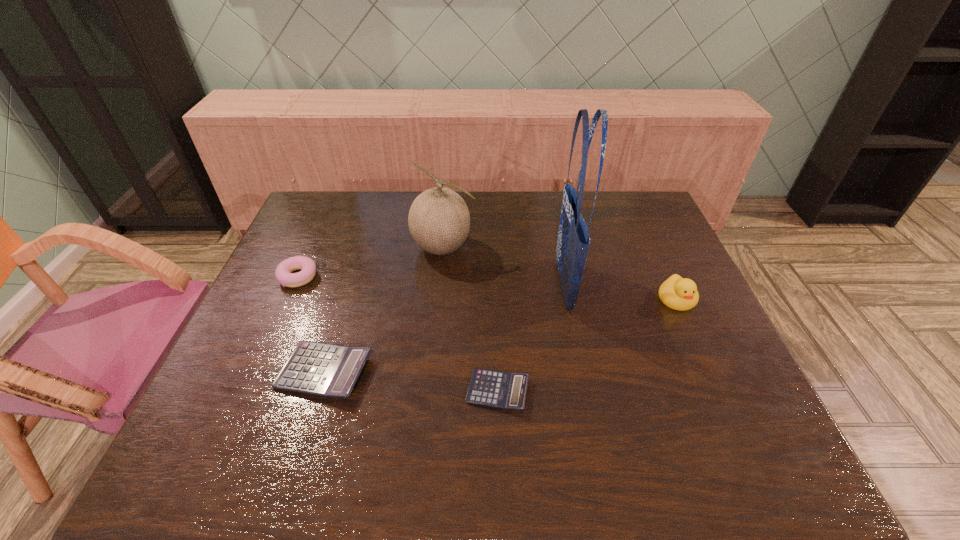
The width and height of the screenshot is (960, 540). What are the coordinates of `vacant space situated on the right of the left calculator` in the screenshot? It's located at (464, 372).

You are a GUI agent. You are given a task and a screenshot of the screen. Output one action in this format:
    pyautogui.click(x=<x>, y=<y>)
    Task: Click on the free space located on the right of the right calculator
    The height and width of the screenshot is (540, 960).
    Given the screenshot: What is the action you would take?
    pyautogui.click(x=626, y=391)

Image resolution: width=960 pixels, height=540 pixels. I want to click on free space located on the front-facing side of the tallest object, so click(463, 285).

This screenshot has width=960, height=540. Identify the location of free point located on the front-facing side of the tallest object. (427, 285).

Find the location of a particular element. The width and height of the screenshot is (960, 540). free point located 0.160m on the front-facing side of the tallest object is located at coordinates pyautogui.click(x=498, y=285).

Where is `free region located on the front of the doughnut`? This screenshot has height=540, width=960. free region located on the front of the doughnut is located at coordinates (274, 335).

Where is `blank space located on the front of the cantaloup`? blank space located on the front of the cantaloup is located at coordinates (436, 328).

Identify the location of vacant space situated 0.090m on the face of the duckling. This screenshot has width=960, height=540. (696, 341).

The height and width of the screenshot is (540, 960). Identify the location of object located in the far edge section of the desktop. (439, 221).

Where is `calculator that is at the left edge`? calculator that is at the left edge is located at coordinates (328, 370).